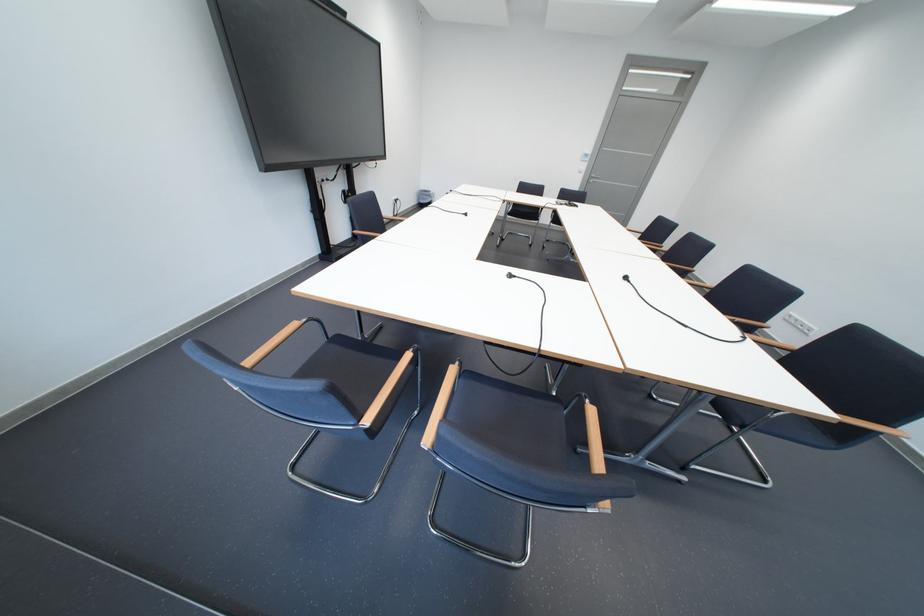
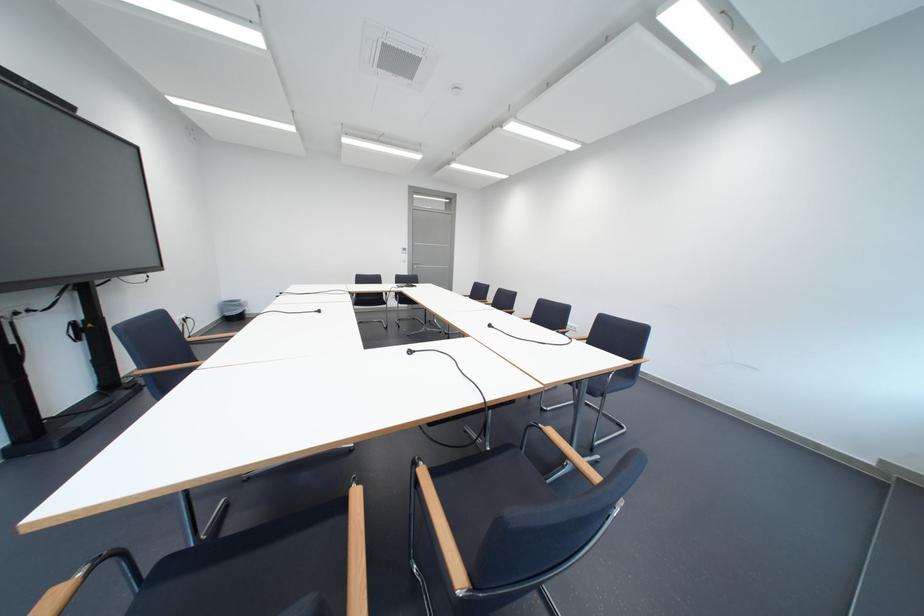
In the second image, find the point that corresponds to (x=602, y=180) in the first image.

(426, 265)